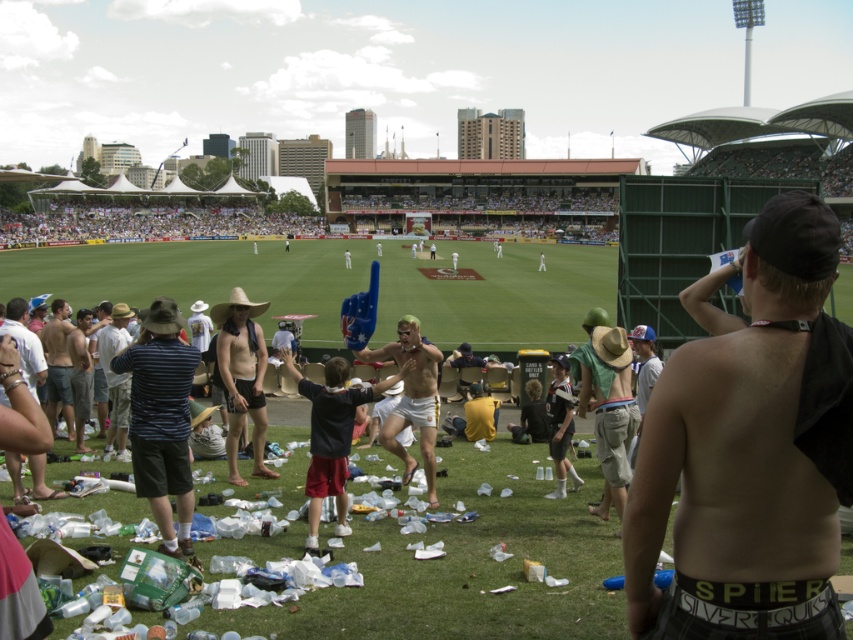
Does green grass at center appear on the right side of striped fabric shirt at left?

Yes, green grass at center is to the right of striped fabric shirt at left.

Is point (490, 244) farther from viewer compared to point (189, 484)?

Yes, it is.

Is point (577, 317) positioned before point (171, 445)?

That is False.

Where is `green grass at center`? green grass at center is located at coordinates pos(341,284).

Does green grass at center have a smaller size compared to striped shirt at center?

No.

Does green grass at center have a larger size compared to striped shirt at center?

Indeed, green grass at center has a larger size compared to striped shirt at center.

This screenshot has width=853, height=640. Find the location of `green grass at center`. green grass at center is located at coordinates (341, 284).

Locate an element on the screen. The image size is (853, 640). striped shirt at center is located at coordinates click(x=115, y=378).

Does striped shirt at center have a greater height compared to shiny metallic shorts at lower left?

No, striped shirt at center is not taller than shiny metallic shorts at lower left.

At what (x,y) coordinates should I click in order to perform the action: click on striped shirt at center. Please return your answer as a coordinate pair (x, y). Looking at the image, I should click on (115, 378).